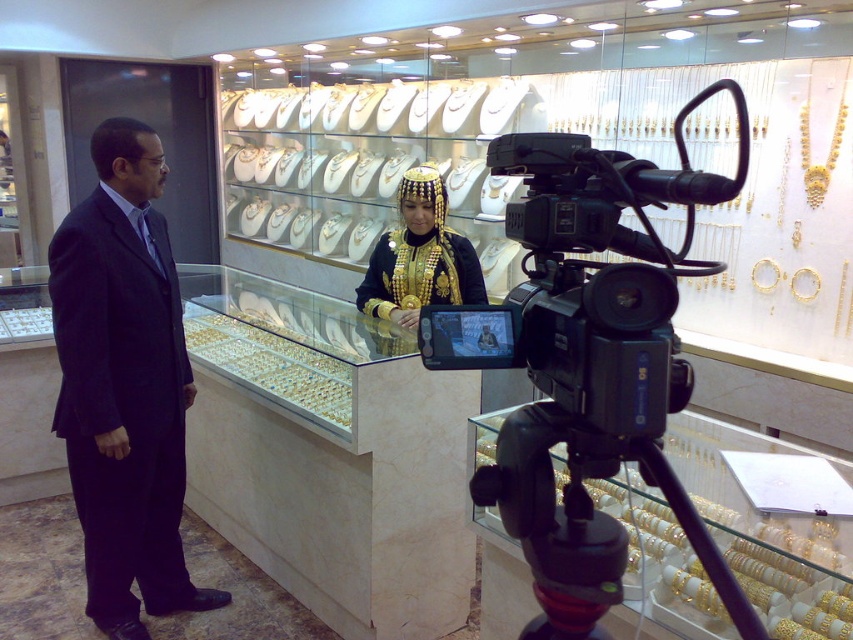
Which is behind, point (627, 276) or point (605, 596)?

Positioned behind is point (605, 596).

Is black plastic video camera at center above black plastic tripod at lower center?

Yes.

This screenshot has height=640, width=853. Identify the location of black plastic video camera at center. (589, 362).

Locate an element on the screen. black plastic video camera at center is located at coordinates (589, 362).

Does black plastic video camera at center appear on the left side of dark blue suit at left?

No, black plastic video camera at center is not to the left of dark blue suit at left.

Who is shorter, black plastic video camera at center or dark blue suit at left?

black plastic video camera at center

Between point (512, 332) and point (93, 548), which one is positioned behind?

Point (93, 548)

Find the location of `black plastic video camera at center`. black plastic video camera at center is located at coordinates [x=589, y=362].

Between dark blue suit at left and black plastic tripod at lower center, which one is positioned lower?

black plastic tripod at lower center is lower down.

Is dark blue suit at left positioned in front of black plastic tripod at lower center?

No, it is not.

Where is `dark blue suit at left`? dark blue suit at left is located at coordinates 125,385.